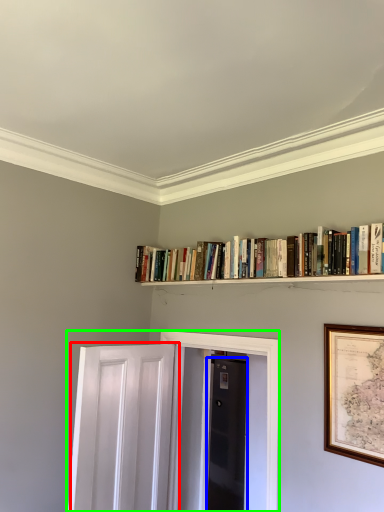
Question: Considering the real-world distances, which object is farthest from door (highlighted by a red box)? door (highlighted by a blue box) or elevator (highlighted by a green box)?

Choices:
 (A) door
 (B) elevator

Answer: (A)